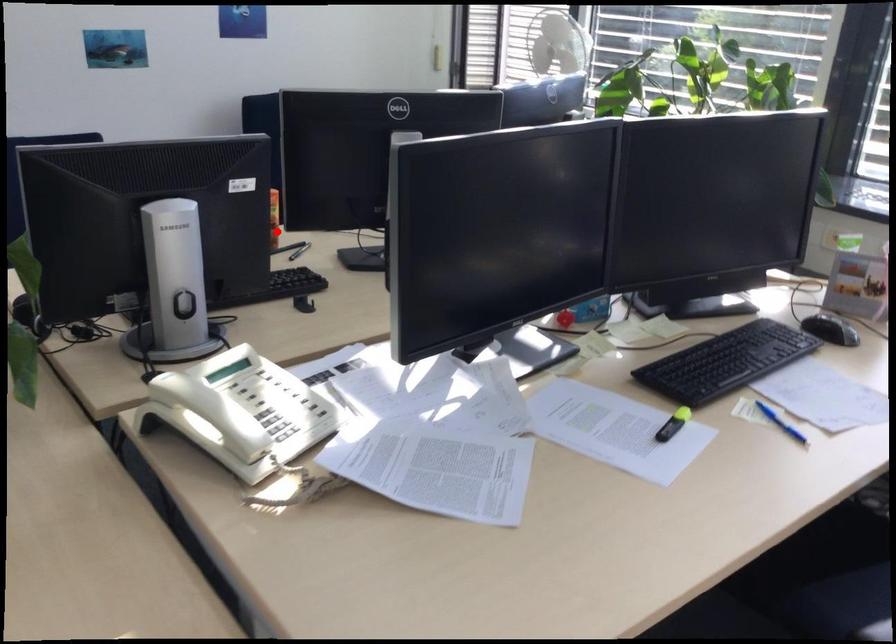
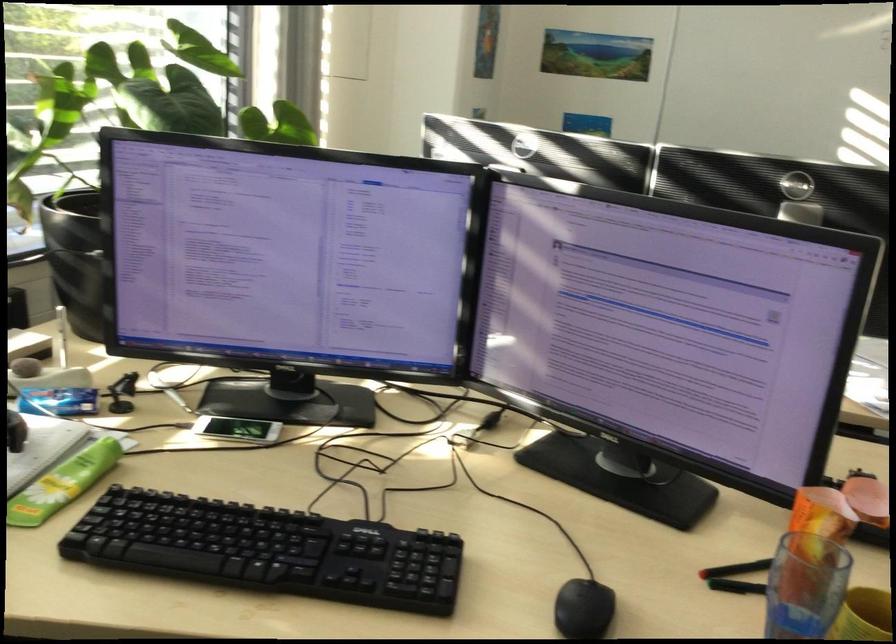
Where in the second image is the point corresponding to the highlighted location from the first image?

(805, 585)